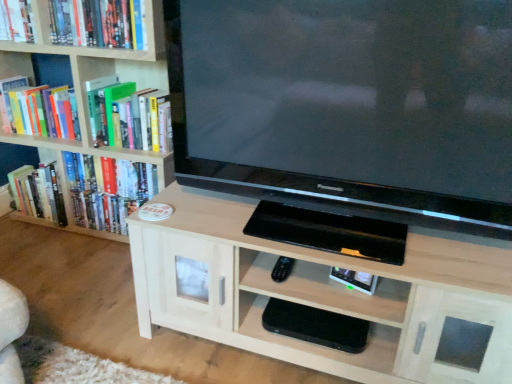
Where is `free spot above light wood cabinet at center, arranged as the first shelf when viewed from the top (from a real-world perspective)`? This screenshot has height=384, width=512. free spot above light wood cabinet at center, arranged as the first shelf when viewed from the top (from a real-world perspective) is located at coordinates (339, 231).